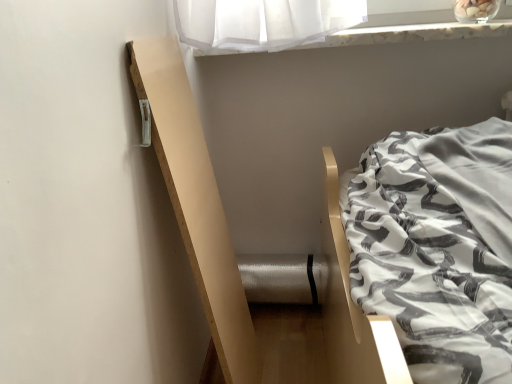
Question: Can you confirm if white marble window sill at upper center is shorter than natural wood balustrade at left?

Choices:
 (A) no
 (B) yes

Answer: (B)

Question: Is white marble window sill at upper center smaller than natural wood balustrade at left?

Choices:
 (A) no
 (B) yes

Answer: (A)

Question: Are white marble window sill at upper center and natural wood balustrade at left far apart?

Choices:
 (A) yes
 (B) no

Answer: (B)

Question: Considering the relative positions of white marble window sill at upper center and natural wood balustrade at left in the image provided, is white marble window sill at upper center to the left of natural wood balustrade at left from the viewer's perspective?

Choices:
 (A) no
 (B) yes

Answer: (A)

Question: Is white marble window sill at upper center taller than natural wood balustrade at left?

Choices:
 (A) yes
 (B) no

Answer: (B)

Question: Is white marble window sill at upper center closer to the viewer compared to natural wood balustrade at left?

Choices:
 (A) yes
 (B) no

Answer: (B)

Question: Is natural wood balustrade at left far away from white marble window sill at upper center?

Choices:
 (A) yes
 (B) no

Answer: (B)

Question: Does natural wood balustrade at left appear on the left side of white marble window sill at upper center?

Choices:
 (A) yes
 (B) no

Answer: (A)

Question: Does natural wood balustrade at left have a greater width compared to white marble window sill at upper center?

Choices:
 (A) yes
 (B) no

Answer: (B)

Question: Is natural wood balustrade at left oriented away from white marble window sill at upper center?

Choices:
 (A) yes
 (B) no

Answer: (B)

Question: From a real-world perspective, does natural wood balustrade at left sit lower than white marble window sill at upper center?

Choices:
 (A) no
 (B) yes

Answer: (B)

Question: Does natural wood balustrade at left touch white marble window sill at upper center?

Choices:
 (A) no
 (B) yes

Answer: (A)

Question: Looking at the image, does white marble window sill at upper center seem bigger or smaller compared to natural wood balustrade at left?

Choices:
 (A) small
 (B) big

Answer: (B)